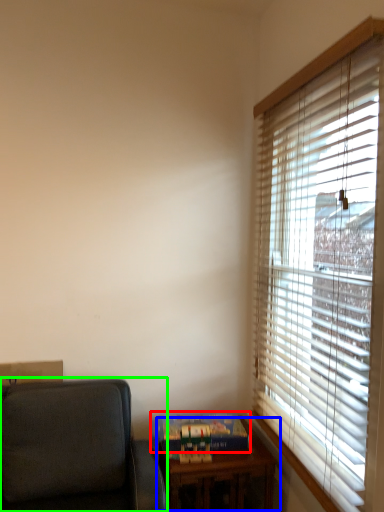
Question: Based on their relative distances, which object is farther from paperback book (highlighted by a red box)? Choose from table (highlighted by a blue box) and studio couch (highlighted by a green box).

Choices:
 (A) table
 (B) studio couch

Answer: (B)